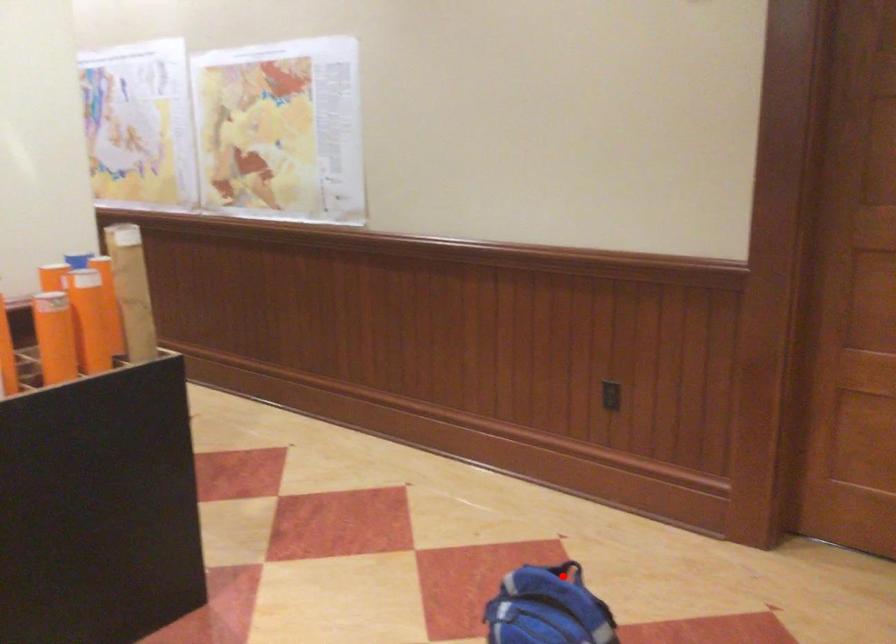
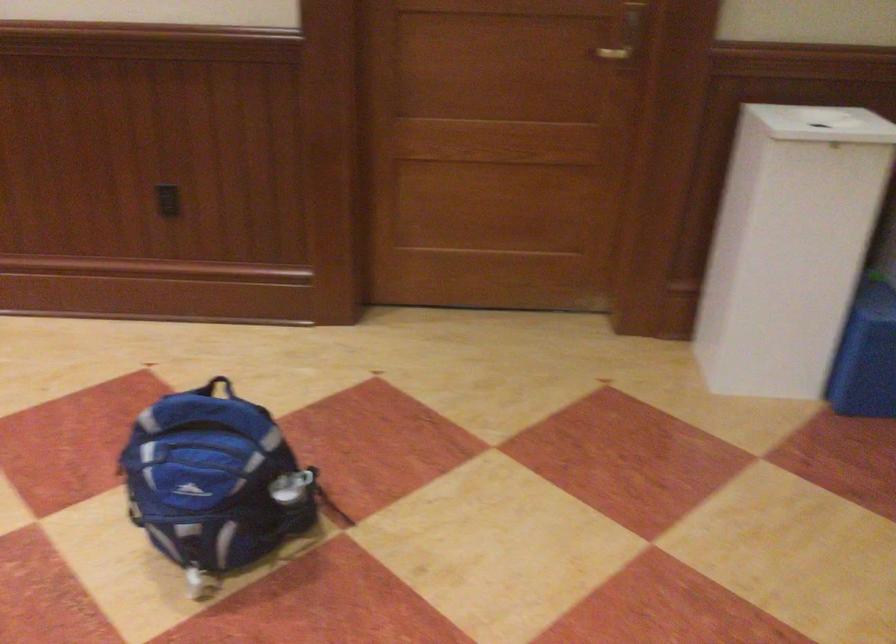
Where in the second image is the point corresponding to the highlighted location from the first image?

(217, 386)